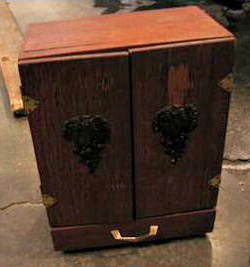
I want to click on drawer handle, so click(x=138, y=239).